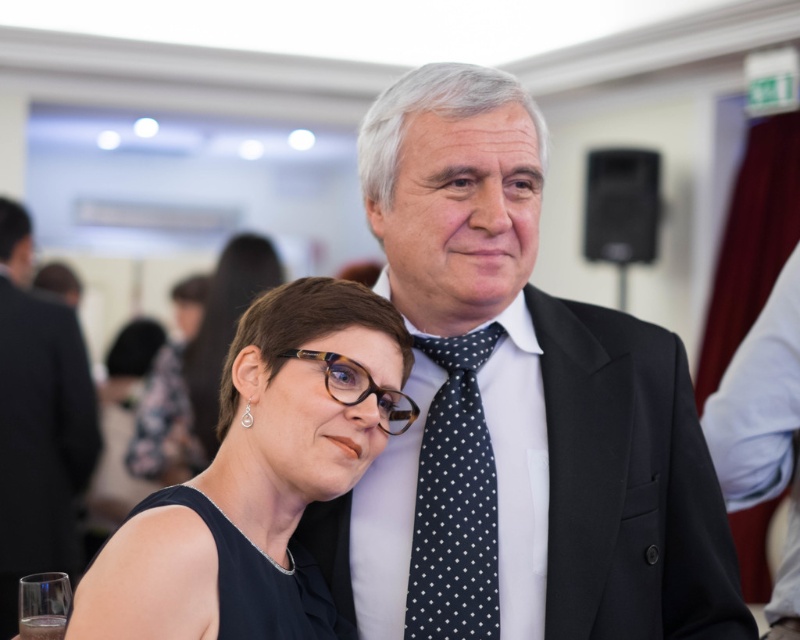
You are a photographer adjusting your camera settings. You notice the matte black suit at center in the image. Based on its position, can you determine if it is closer to the top or bottom edge of the frame?

The matte black suit at center is located at point coordinates approximately 0.659 on the x and 0.049 on the y. Since the y coordinate is closer to 0, which typically represents the top edge of an image, the matte black suit at center is closer to the top edge of the frame.

You are a photographer at the event and want to ensure both the matte black suit at center and the brown tortoiseshell glasses at center are clearly visible in your photo. Given their sizes, which object might require more careful framing to avoid being too small in the shot?

The brown tortoiseshell glasses at center might require more careful framing since it is smaller in size than the matte black suit at center, making it easier to appear too small in the photo.